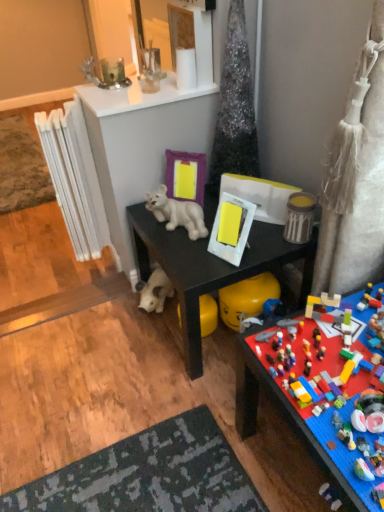
Question: From a real-world perspective, is multicolored plastic lego set at lower right, the 6th toy from the top, above or below white plush toy at lower center, which is the 2th toy from bottom to top?

Choices:
 (A) below
 (B) above

Answer: (B)

Question: Considering the relative positions of multicolored plastic lego set at lower right, the 6th toy from the top, and white plush toy at lower center, acting as the fifth toy starting from the top, in the image provided, is multicolored plastic lego set at lower right, the 6th toy from the top, to the left or to the right of white plush toy at lower center, acting as the fifth toy starting from the top,?

Choices:
 (A) left
 (B) right

Answer: (B)

Question: Estimate the real-world distances between objects in this image. Which object is closer to the white plush toy at lower center, which is the 2th toy from bottom to top?

Choices:
 (A) black matte desk at center
 (B) green glass candle at upper center, the 1th toy viewed from the top
 (C) purple matte picture frame at center, the second picture frame when ordered from bottom to top
 (D) white glossy plastic lion at center, which is counted as the 4th toy, starting from the bottom
 (E) white glossy mirror at upper center

Answer: (A)

Question: Which is farther from the clear glass container at upper center, arranged as the 5th toy when ordered from the bottom?

Choices:
 (A) white glossy mirror at upper center
 (B) black matte desk at center
 (C) green glass candle at upper center, the 1th toy viewed from the top
 (D) purple matte picture frame at center, the second picture frame when ordered from bottom to top
 (E) white plush toy at lower center, acting as the fifth toy starting from the top

Answer: (B)